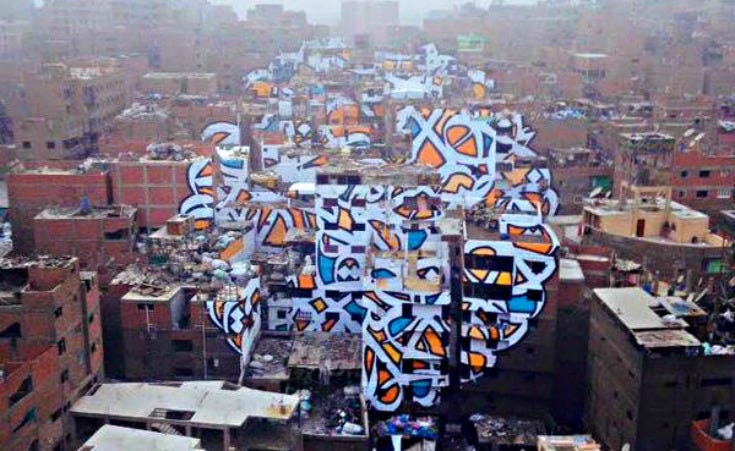
I want to click on white roof, so click(236, 406).